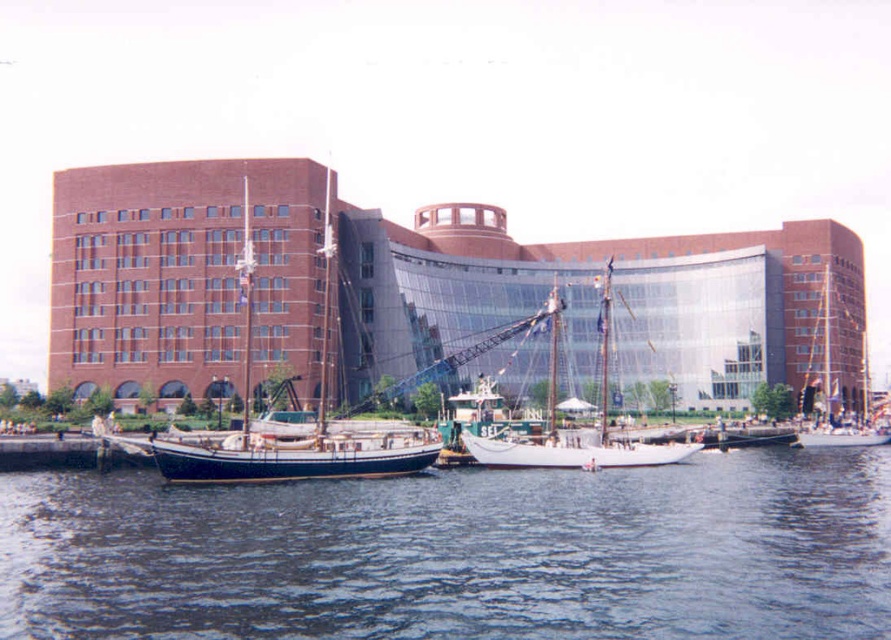
You are standing on the pier and want to compare the size of the blue water at center and the dark blue polished wood sailboat at left. Which one is wider?

The blue water at center is wider than the dark blue polished wood sailboat at left according to the description.

You are standing on the pier and see the blue water at center and the white wooden sailboat at center. Which object takes up more area in the image?

The white wooden sailboat at center occupies more space than the blue water at center according to the description.

You are a photographer planning to take a photo of the waterfront scene. You want to include both the dark blue polished wood sailboat at left and the white wooden sailboat at center in your shot. Which boat should you focus on first if you want to capture them in order from closest to farthest?

You should focus on the dark blue polished wood sailboat at left first because it is closer to the viewer than the white wooden sailboat at center.